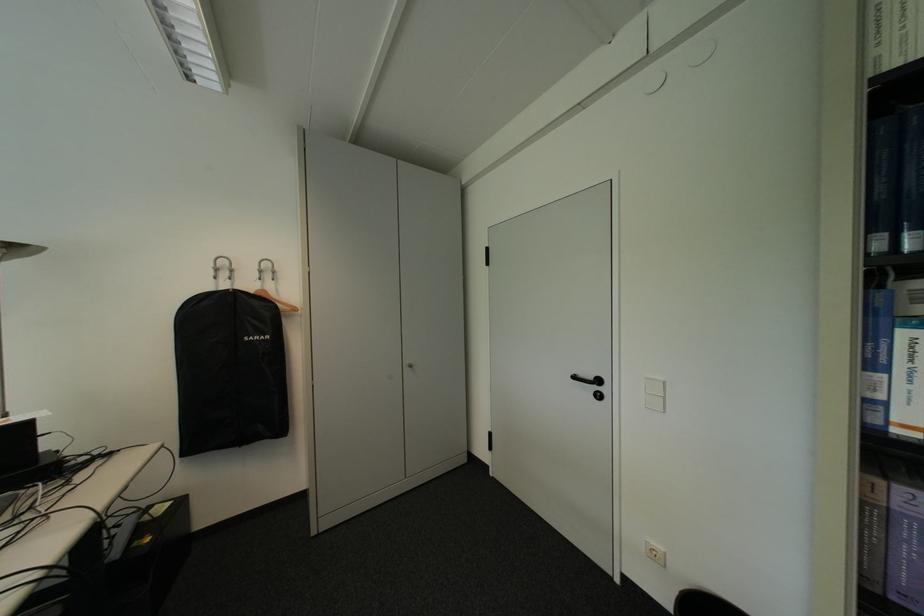
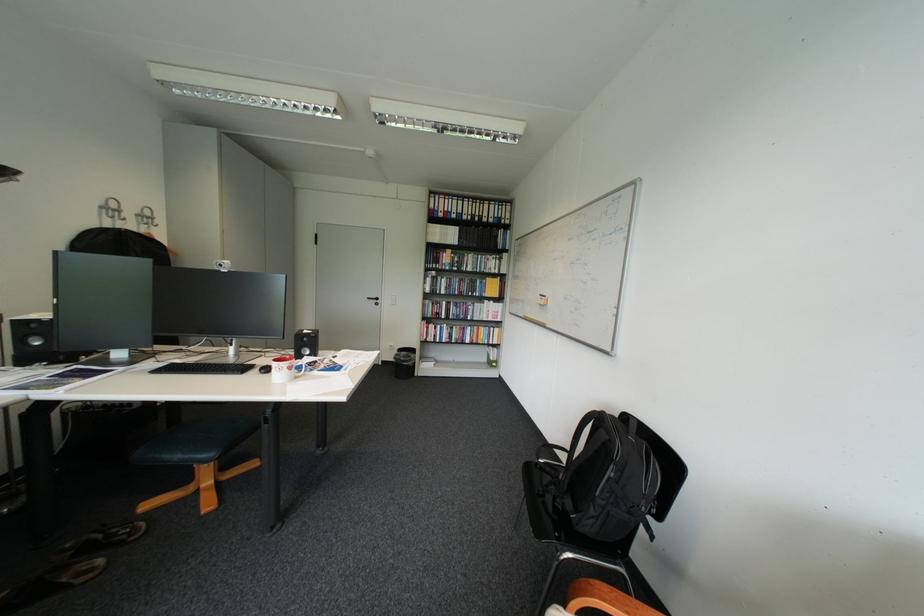
In the second image, find the point that corresponds to (x=587, y=378) in the first image.

(381, 299)